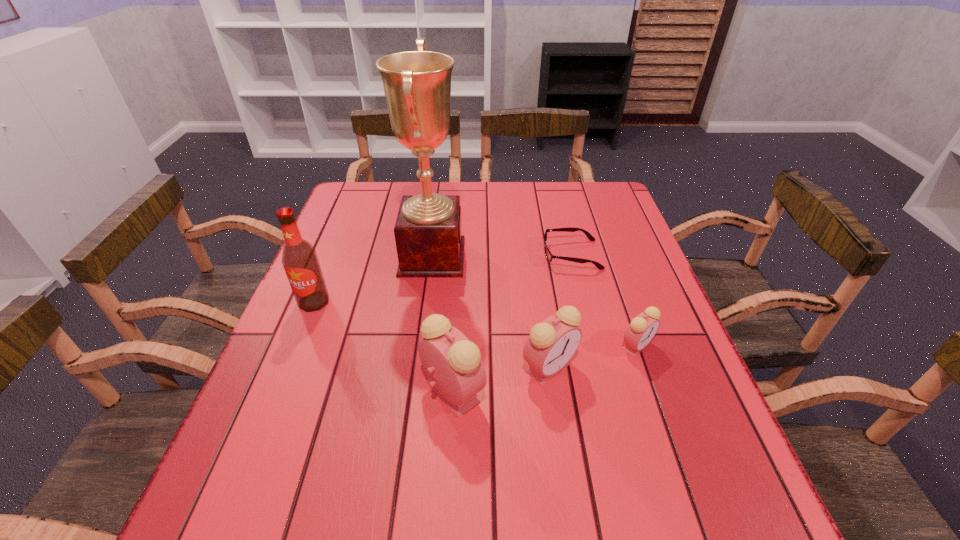
Find the location of `empty space that is in between the fifth tallest object and the fifth shortest object`. empty space that is in between the fifth tallest object and the fifth shortest object is located at coordinates 475,324.

The image size is (960, 540). Find the location of `empty space between the shortest alarm clock and the fourth tallest object`. empty space between the shortest alarm clock and the fourth tallest object is located at coordinates (593, 357).

Locate an element on the screen. This screenshot has height=540, width=960. free space between the second shortest object and the spectacles is located at coordinates (604, 300).

Where is `blank region between the second alarm clock from left to right and the leftmost alarm clock`? blank region between the second alarm clock from left to right and the leftmost alarm clock is located at coordinates (501, 380).

Locate which object ranks third in proximity to the second shortest object. Please provide its 2D coordinates. Your answer should be formatted as a tuple, i.e. [(x, y)], where the tuple contains the x and y coordinates of a point satisfying the conditions above.

[(456, 373)]

This screenshot has width=960, height=540. In order to click on object that can be found as the third closest to the trophy cup in this screenshot , I will do `click(552, 343)`.

Find the location of `alarm clock that is the second closest to the shortest alarm clock`. alarm clock that is the second closest to the shortest alarm clock is located at coordinates (456, 373).

At what (x,y) coordinates should I click in order to perform the action: click on the closest alarm clock to the leftmost alarm clock. Please return your answer as a coordinate pair (x, y). The image size is (960, 540). Looking at the image, I should click on (552, 343).

You are a GUI agent. You are given a task and a screenshot of the screen. Output one action in this format:
    pyautogui.click(x=<x>, y=<y>)
    Task: Click on the free point that satisfies the following two spatial constraints: 1. on the face of the third shortest object; 2. on the face of the leftmost alarm clock
    
    Given the screenshot: What is the action you would take?
    pyautogui.click(x=553, y=392)

Locate an element on the screen. Image resolution: width=960 pixels, height=540 pixels. free space that satisfies the following two spatial constraints: 1. on the face of the second alarm clock from left to right; 2. on the face of the leftmost alarm clock is located at coordinates (553, 392).